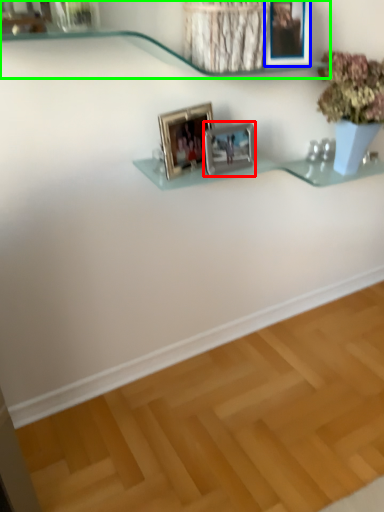
Question: Based on their relative distances, which object is farther from picture frame (highlighted by a red box)? Choose from picture frame (highlighted by a blue box) and shelf (highlighted by a green box).

Choices:
 (A) picture frame
 (B) shelf

Answer: (B)